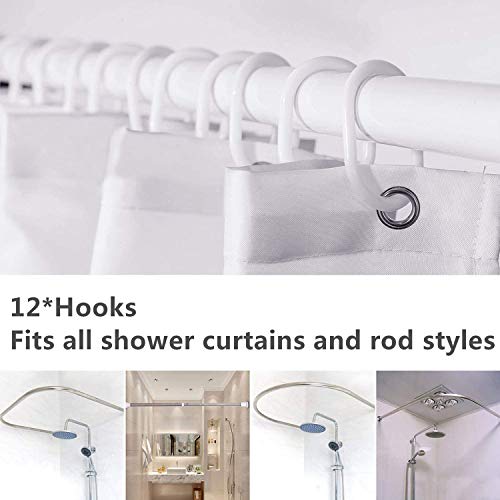
Where is `hook`? Image resolution: width=500 pixels, height=500 pixels. hook is located at coordinates (151, 113).